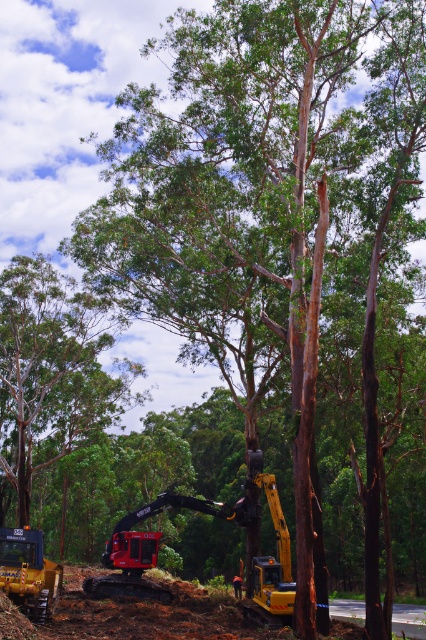
Which is behind, point (0, 385) or point (17, 593)?

Positioned behind is point (0, 385).

Does green rough bark tree at upper left appear under yellow rubber tracked excavator at lower left?

No, green rough bark tree at upper left is not below yellow rubber tracked excavator at lower left.

Which is in front, point (69, 305) or point (31, 573)?

Positioned in front is point (31, 573).

Where is `green rough bark tree at upper left`? This screenshot has width=426, height=640. green rough bark tree at upper left is located at coordinates (51, 374).